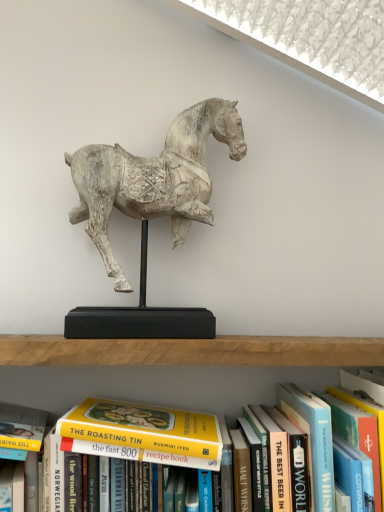
Question: Is hardcover book at center, arranged as the 2th paperback book when viewed from the left, with white wood horse at center?

Choices:
 (A) no
 (B) yes

Answer: (A)

Question: From the image's perspective, is hardcover book at center, the 1th paperback book viewed from the right, below white wood horse at center?

Choices:
 (A) no
 (B) yes

Answer: (B)

Question: Is hardcover book at center, the 1th paperback book viewed from the right, taller than white wood horse at center?

Choices:
 (A) no
 (B) yes

Answer: (A)

Question: Is white wood horse at center inside hardcover book at center, arranged as the 2th paperback book when viewed from the left?

Choices:
 (A) yes
 (B) no

Answer: (B)

Question: From a real-world perspective, is hardcover book at center, the 1th paperback book viewed from the right, physically above white wood horse at center?

Choices:
 (A) yes
 (B) no

Answer: (B)

Question: Is white wood horse at center inside or outside of hardcover book at center, arranged as the 2th paperback book when viewed from the left?

Choices:
 (A) outside
 (B) inside

Answer: (A)

Question: From their relative heights in the image, would you say white wood horse at center is taller or shorter than hardcover book at center, the 1th paperback book viewed from the right?

Choices:
 (A) tall
 (B) short

Answer: (A)

Question: Does point (104, 232) appear closer or farther from the camera than point (354, 442)?

Choices:
 (A) closer
 (B) farther

Answer: (B)

Question: From the image's perspective, is white wood horse at center above or below hardcover book at center, arranged as the 2th paperback book when viewed from the left?

Choices:
 (A) below
 (B) above

Answer: (B)

Question: Do you think hardcover book at center, which is counted as the first paperback book, starting from the left, is within white wood horse at center, or outside of it?

Choices:
 (A) outside
 (B) inside

Answer: (A)

Question: Is hardcover book at center, acting as the 2th paperback book starting from the right, taller or shorter than white wood horse at center?

Choices:
 (A) short
 (B) tall

Answer: (A)

Question: Relative to white wood horse at center, is hardcover book at center, which is counted as the first paperback book, starting from the left, in front or behind?

Choices:
 (A) behind
 (B) front

Answer: (B)

Question: From the image's perspective, is hardcover book at center, which is counted as the first paperback book, starting from the left, positioned above or below white wood horse at center?

Choices:
 (A) below
 (B) above

Answer: (A)

Question: From a real-world perspective, is hardcover book at center, acting as the 2th paperback book starting from the right, positioned above or below hardcover book at center, arranged as the 2th paperback book when viewed from the left?

Choices:
 (A) above
 (B) below

Answer: (A)

Question: Based on their sizes in the image, would you say hardcover book at center, acting as the 2th paperback book starting from the right, is bigger or smaller than hardcover book at center, arranged as the 2th paperback book when viewed from the left?

Choices:
 (A) big
 (B) small

Answer: (A)